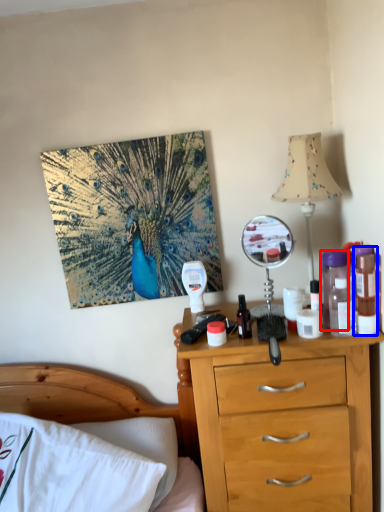
Question: Which of the following is the closest to the observer, bottle (highlighted by a red box) or bottle (highlighted by a blue box)?

Choices:
 (A) bottle
 (B) bottle

Answer: (B)